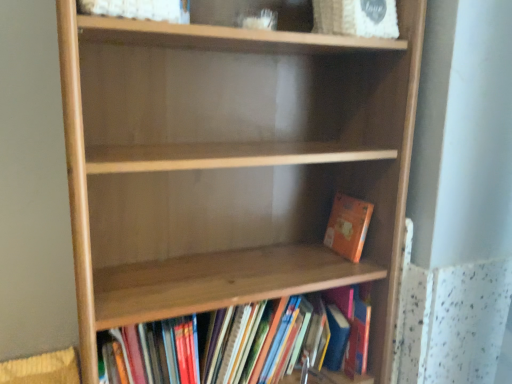
What is the approximate height of orange matte book at lower right, the first book viewed from the top?

6.96 inches.

Locate an element on the screen. The image size is (512, 384). orange matte book at lower right, positioned as the second book in bottom-to-top order is located at coordinates (348, 226).

Can you tell me how much orange matte book at lower right, the first book viewed from the top, and wooden bookshelf at lower center, which is the first book in bottom-to-top order, differ in facing direction?

3.61 degrees.

Between orange matte book at lower right, the first book viewed from the top, and wooden bookshelf at lower center, which is the first book in bottom-to-top order, which one is positioned behind?

Positioned behind is orange matte book at lower right, the first book viewed from the top.

Measure the distance from orange matte book at lower right, the first book viewed from the top, to wooden bookshelf at lower center, which is the first book in bottom-to-top order.

A distance of 33.51 centimeters exists between orange matte book at lower right, the first book viewed from the top, and wooden bookshelf at lower center, which is the first book in bottom-to-top order.

Consider the image. From a real-world perspective, is orange matte book at lower right, positioned as the second book in bottom-to-top order, above or below wooden bookshelf at lower center, acting as the 2th book starting from the top?

From a real-world perspective, orange matte book at lower right, positioned as the second book in bottom-to-top order, is physically above wooden bookshelf at lower center, acting as the 2th book starting from the top.

Which is in front, point (272, 339) or point (108, 328)?

The point (108, 328) is closer.

Is wooden bookshelf at lower center, acting as the 2th book starting from the top, taller than natural wood shelf at center?

In fact, wooden bookshelf at lower center, acting as the 2th book starting from the top, may be shorter than natural wood shelf at center.

From a real-world perspective, does wooden bookshelf at lower center, which is the first book in bottom-to-top order, sit lower than natural wood shelf at center?

Yes, from a real-world perspective, wooden bookshelf at lower center, which is the first book in bottom-to-top order, is below natural wood shelf at center.

Which is behind, wooden bookshelf at lower center, which is the first book in bottom-to-top order, or orange matte book at lower right, positioned as the second book in bottom-to-top order?

orange matte book at lower right, positioned as the second book in bottom-to-top order.

Does wooden bookshelf at lower center, which is the first book in bottom-to-top order, have a greater height compared to orange matte book at lower right, positioned as the second book in bottom-to-top order?

Correct, wooden bookshelf at lower center, which is the first book in bottom-to-top order, is much taller as orange matte book at lower right, positioned as the second book in bottom-to-top order.

At what (x,y) coordinates should I click in order to perform the action: click on book on the right of wooden bookshelf at lower center, which is the first book in bottom-to-top order. Please return your answer as a coordinate pair (x, y). The width and height of the screenshot is (512, 384). Looking at the image, I should click on (348, 226).

From the image's perspective, is natural wood shelf at center below wooden bookshelf at lower center, acting as the 2th book starting from the top?

Actually, natural wood shelf at center appears above wooden bookshelf at lower center, acting as the 2th book starting from the top, in the image.

From the picture: Are natural wood shelf at center and wooden bookshelf at lower center, acting as the 2th book starting from the top, located far from each other?

No, natural wood shelf at center is not far away from wooden bookshelf at lower center, acting as the 2th book starting from the top.

From the image's perspective, which one is positioned lower, natural wood shelf at center or orange matte book at lower right, positioned as the second book in bottom-to-top order?

natural wood shelf at center.

Is natural wood shelf at center smaller than orange matte book at lower right, positioned as the second book in bottom-to-top order?

No, natural wood shelf at center is not smaller than orange matte book at lower right, positioned as the second book in bottom-to-top order.

Is natural wood shelf at center wider than orange matte book at lower right, the first book viewed from the top?

Correct, the width of natural wood shelf at center exceeds that of orange matte book at lower right, the first book viewed from the top.

Is point (342, 209) closer to camera compared to point (176, 290)?

No, (342, 209) is further to viewer.

From a real-world perspective, is orange matte book at lower right, positioned as the second book in bottom-to-top order, positioned above or below natural wood shelf at center?

orange matte book at lower right, positioned as the second book in bottom-to-top order, is above natural wood shelf at center.

Is orange matte book at lower right, the first book viewed from the top, taller or shorter than natural wood shelf at center?

Clearly, orange matte book at lower right, the first book viewed from the top, is shorter compared to natural wood shelf at center.

Is orange matte book at lower right, positioned as the second book in bottom-to-top order, surrounding natural wood shelf at center?

No, orange matte book at lower right, positioned as the second book in bottom-to-top order, does not contain natural wood shelf at center.

Locate an element on the screen. book that is below the orange matte book at lower right, the first book viewed from the top (from the image's perspective) is located at coordinates (243, 344).

Where is `shelf above the wooden bookshelf at lower center, acting as the 2th book starting from the top (from the image's perspective)`? This screenshot has width=512, height=384. shelf above the wooden bookshelf at lower center, acting as the 2th book starting from the top (from the image's perspective) is located at coordinates (230, 165).

Looking at the image, which one is located closer to natural wood shelf at center, orange matte book at lower right, positioned as the second book in bottom-to-top order, or wooden bookshelf at lower center, acting as the 2th book starting from the top?

wooden bookshelf at lower center, acting as the 2th book starting from the top, is closer to natural wood shelf at center.

Estimate the real-world distances between objects in this image. Which object is closer to wooden bookshelf at lower center, acting as the 2th book starting from the top, natural wood shelf at center or orange matte book at lower right, positioned as the second book in bottom-to-top order?

natural wood shelf at center lies closer to wooden bookshelf at lower center, acting as the 2th book starting from the top, than the other object.

When comparing their distances from orange matte book at lower right, the first book viewed from the top, does natural wood shelf at center or wooden bookshelf at lower center, which is the first book in bottom-to-top order, seem further?

natural wood shelf at center lies further to orange matte book at lower right, the first book viewed from the top, than the other object.

When comparing their distances from wooden bookshelf at lower center, which is the first book in bottom-to-top order, does orange matte book at lower right, positioned as the second book in bottom-to-top order, or natural wood shelf at center seem closer?

natural wood shelf at center is closer to wooden bookshelf at lower center, which is the first book in bottom-to-top order.

Looking at this image, from the image, which object appears to be farther from natural wood shelf at center, wooden bookshelf at lower center, acting as the 2th book starting from the top, or orange matte book at lower right, positioned as the second book in bottom-to-top order?

orange matte book at lower right, positioned as the second book in bottom-to-top order.

From the image, which object appears to be farther from orange matte book at lower right, positioned as the second book in bottom-to-top order, wooden bookshelf at lower center, which is the first book in bottom-to-top order, or natural wood shelf at center?

Among the two, natural wood shelf at center is located further to orange matte book at lower right, positioned as the second book in bottom-to-top order.

The width and height of the screenshot is (512, 384). I want to click on book between natural wood shelf at center and orange matte book at lower right, the first book viewed from the top, along the z-axis, so click(x=243, y=344).